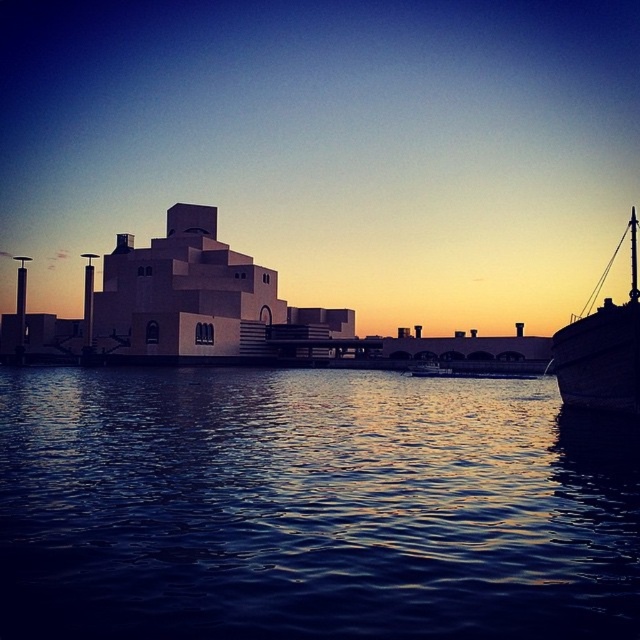
What is located at the coordinates point (310, 506) in the image?

The coordinates point (310, 506) indicate the location of dark blue liquid at center.

You are standing at the waterfront and looking at the two points marked in the scene. Which point, point (474, 499) or point (628, 403), is nearer to your current position?

Point (474, 499) is closer to the camera than point (628, 403), so it is nearer to your current position.

You are standing at the waterfront and want to take a photo of both the dark blue liquid at center and the wooden ship at right. Which object should you focus on first to ensure both are in clear view?

You should focus on the dark blue liquid at center first since it is closer to the viewer than the wooden ship at right, ensuring both are in clear view by starting with the closer object.